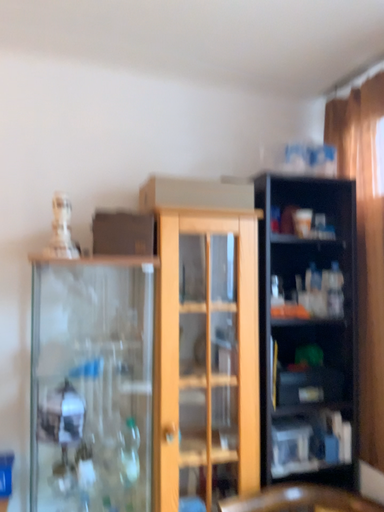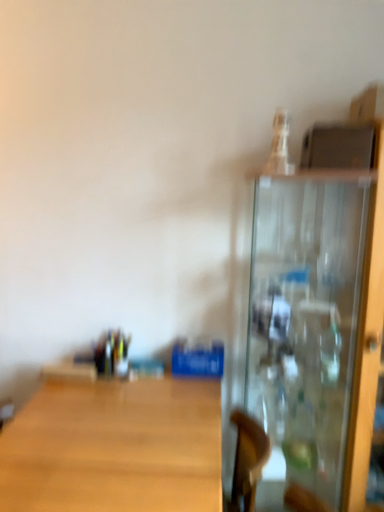
Question: Which way did the camera rotate in the video?

Choices:
 (A) rotated downward
 (B) rotated upward

Answer: (A)